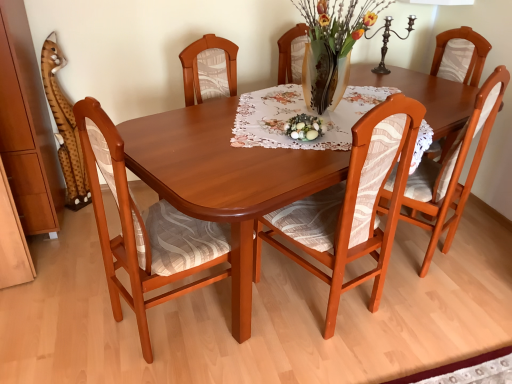
Locate an element on the screen. free space to the right of matte wood chair at center, the 2th chair from the right is located at coordinates (416, 319).